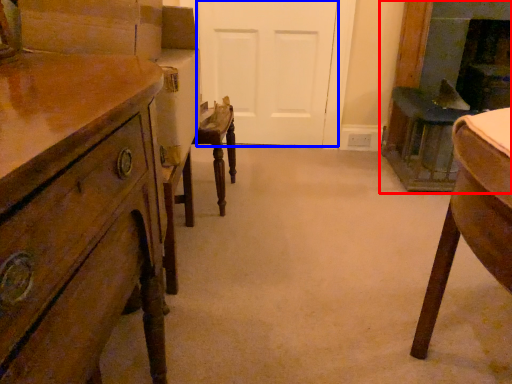
Question: Which object appears closest to the camera in this image, fireplace (highlighted by a red box) or door (highlighted by a blue box)?

Choices:
 (A) fireplace
 (B) door

Answer: (A)